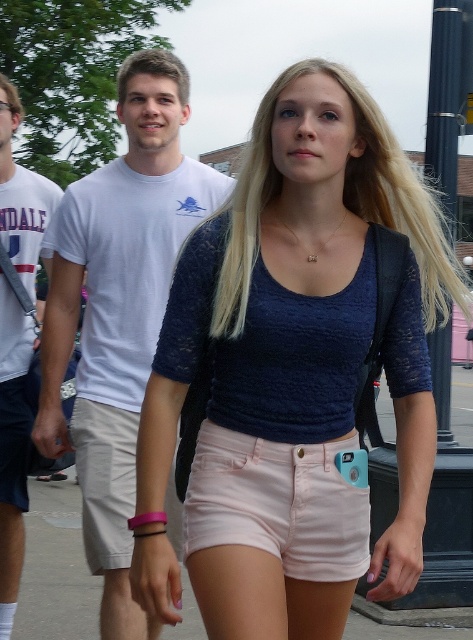
Is the position of blue lace top at center more distant than that of light pink cotton shorts at center?

No.

Does blue lace top at center lie in front of light pink cotton shorts at center?

Yes, blue lace top at center is closer to the viewer.

The width and height of the screenshot is (473, 640). Find the location of `blue lace top at center`. blue lace top at center is located at coordinates (294, 372).

The height and width of the screenshot is (640, 473). I want to click on blue lace top at center, so click(294, 372).

Between point (264, 499) and point (25, 445), which one is positioned behind?

Positioned behind is point (25, 445).

Image resolution: width=473 pixels, height=640 pixels. I want to click on light pink cotton shorts at center, so click(280, 502).

Is light pink cotton shorts at center smaller than matte white t-shirt at upper center?

Yes.

Can you confirm if light pink cotton shorts at center is positioned above matte white t-shirt at upper center?

Actually, light pink cotton shorts at center is below matte white t-shirt at upper center.

Is point (229, 502) farther from camera compared to point (256, 241)?

That is False.

Locate an element on the screen. Image resolution: width=473 pixels, height=640 pixels. light pink cotton shorts at center is located at coordinates (280, 502).